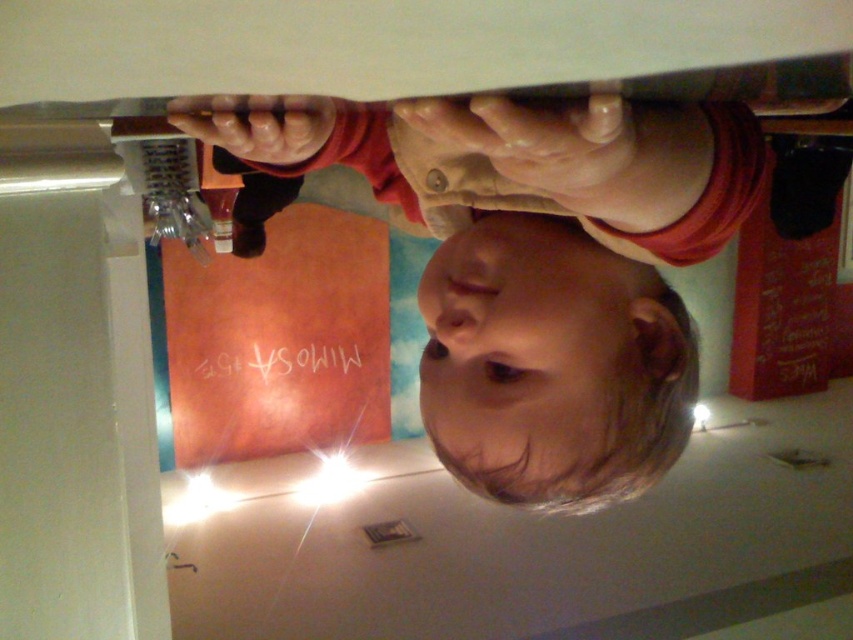
Between smooth skin head at center and matte red shirt at upper center, which one has less height?

matte red shirt at upper center

Is point (489, 324) positioned after point (413, 122)?

Yes.

Identify the location of smooth skin head at center. This screenshot has width=853, height=640. (552, 365).

Between smooth skin child at center and matte red shirt at upper center, which one has less height?

With less height is matte red shirt at upper center.

From the picture: Can you confirm if smooth skin child at center is smaller than matte red shirt at upper center?

Incorrect, smooth skin child at center is not smaller in size than matte red shirt at upper center.

Who is more distant from viewer, (685, 385) or (424, 172)?

The point (685, 385) is more distant.

Where is `smooth skin child at center`? This screenshot has width=853, height=640. smooth skin child at center is located at coordinates (537, 268).

Which is behind, point (503, 332) or point (611, 358)?

Point (611, 358)

Is point (601, 218) in front of point (488, 422)?

Yes, point (601, 218) is closer to viewer.

The width and height of the screenshot is (853, 640). Identify the location of smooth skin child at center. (537, 268).